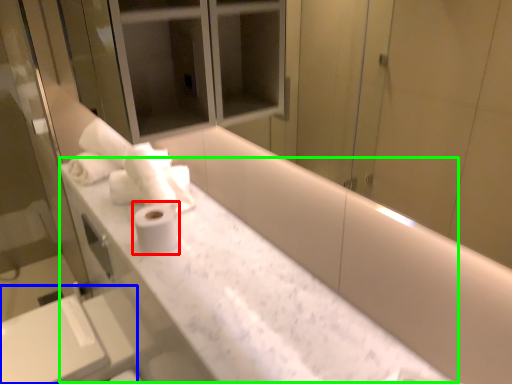
Question: Considering the real-world distances, which object is farthest from toilet paper (highlighted by a red box)? sink (highlighted by a blue box) or counter (highlighted by a green box)?

Choices:
 (A) sink
 (B) counter

Answer: (A)